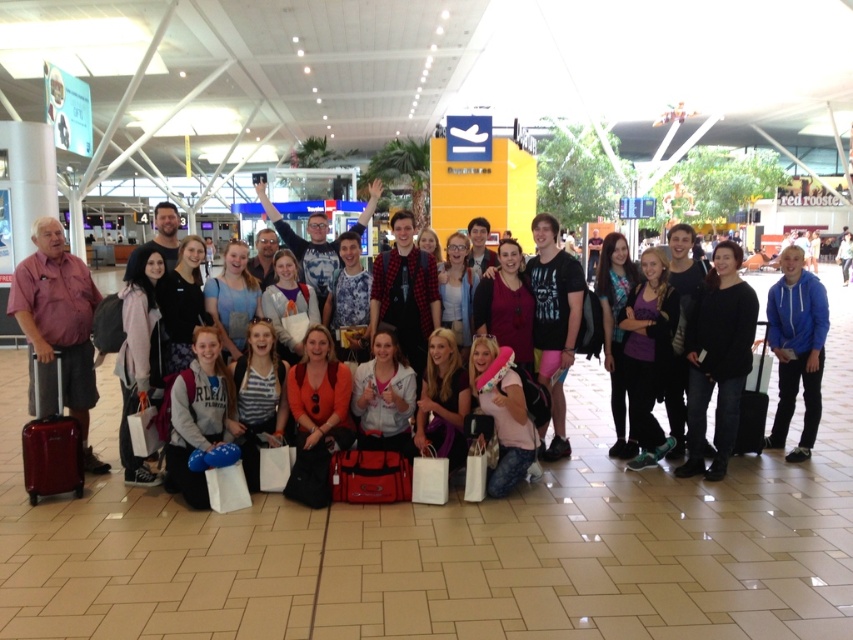
Question: Which of the following is the farthest from the observer?

Choices:
 (A) (700, 404)
 (B) (45, 381)
 (C) (206, 432)

Answer: (A)

Question: Which of the following is the closest to the observer?

Choices:
 (A) (30, 346)
 (B) (463, 385)
 (C) (757, 444)

Answer: (A)

Question: Is pink fabric hat at lower center to the left of black hardshell suitcase at center from the viewer's perspective?

Choices:
 (A) no
 (B) yes

Answer: (B)

Question: Considering the relative positions of pink fabric hat at lower center and matte red suitcase at lower left in the image provided, where is pink fabric hat at lower center located with respect to matte red suitcase at lower left?

Choices:
 (A) left
 (B) right

Answer: (B)

Question: Does flannel shirt at center have a greater width compared to black hardshell suitcase at center?

Choices:
 (A) yes
 (B) no

Answer: (A)

Question: Which object appears closest to the camera in this image?

Choices:
 (A) flannel shirt at center
 (B) black matte jacket at center
 (C) matte red suitcase at lower left

Answer: (C)